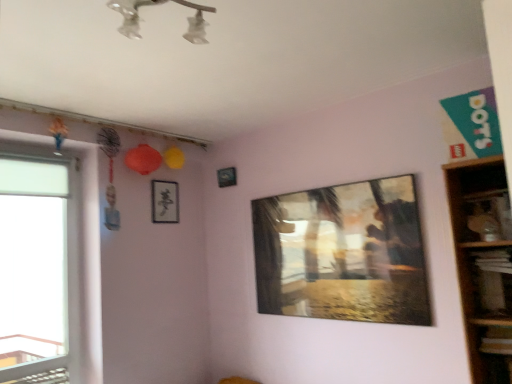
Question: Does metallic reflective painting at center, which is the first picture frame in right-to-left order, have a smaller size compared to black paper at upper center, arranged as the 2th picture frame when viewed from the front?

Choices:
 (A) yes
 (B) no

Answer: (B)

Question: From the image's perspective, would you say metallic reflective painting at center, the 3th picture frame positioned from the left, is shown under black paper at upper center, arranged as the 2th picture frame when viewed from the front?

Choices:
 (A) no
 (B) yes

Answer: (B)

Question: Considering the relative sizes of metallic reflective painting at center, the first picture frame from the front, and black paper at upper center, the 3th picture frame when ordered from right to left, in the image provided, is metallic reflective painting at center, the first picture frame from the front, thinner than black paper at upper center, the 3th picture frame when ordered from right to left,?

Choices:
 (A) no
 (B) yes

Answer: (A)

Question: Does metallic reflective painting at center, the first picture frame from the front, appear on the right side of black paper at upper center, arranged as the 2th picture frame when viewed from the front?

Choices:
 (A) no
 (B) yes

Answer: (B)

Question: Does metallic reflective painting at center, the first picture frame from the front, have a greater width compared to black paper at upper center, the 3th picture frame when ordered from right to left?

Choices:
 (A) yes
 (B) no

Answer: (A)

Question: Does metallic reflective painting at center, the 3th picture frame positioned from the left, come behind black paper at upper center, arranged as the 2th picture frame when viewed from the front?

Choices:
 (A) no
 (B) yes

Answer: (A)

Question: Considering the relative sizes of metallic reflective painting at center, which is the first picture frame in right-to-left order, and transparent glass window at left in the image provided, is metallic reflective painting at center, which is the first picture frame in right-to-left order, smaller than transparent glass window at left?

Choices:
 (A) no
 (B) yes

Answer: (A)

Question: Does metallic reflective painting at center, which is the third picture frame in back-to-front order, have a lesser width compared to transparent glass window at left?

Choices:
 (A) no
 (B) yes

Answer: (B)

Question: Is metallic reflective painting at center, which is the third picture frame in back-to-front order, wider than transparent glass window at left?

Choices:
 (A) yes
 (B) no

Answer: (B)

Question: Does metallic reflective painting at center, the first picture frame from the front, appear on the right side of transparent glass window at left?

Choices:
 (A) yes
 (B) no

Answer: (A)

Question: From a real-world perspective, is metallic reflective painting at center, which is the third picture frame in back-to-front order, on top of transparent glass window at left?

Choices:
 (A) no
 (B) yes

Answer: (A)

Question: Could you tell me if metallic reflective painting at center, which is the third picture frame in back-to-front order, is facing transparent glass window at left?

Choices:
 (A) no
 (B) yes

Answer: (A)

Question: Is wooden shelf at right touching transparent glass window at left?

Choices:
 (A) yes
 (B) no

Answer: (B)